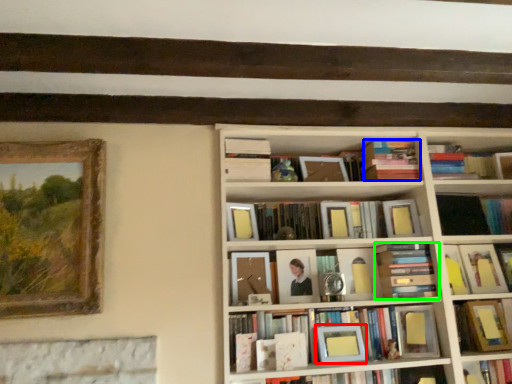
Question: Based on their relative distances, which object is farther from picture frame (highlighted by a red box)? Choose from book (highlighted by a blue box) and book (highlighted by a green box).

Choices:
 (A) book
 (B) book

Answer: (A)